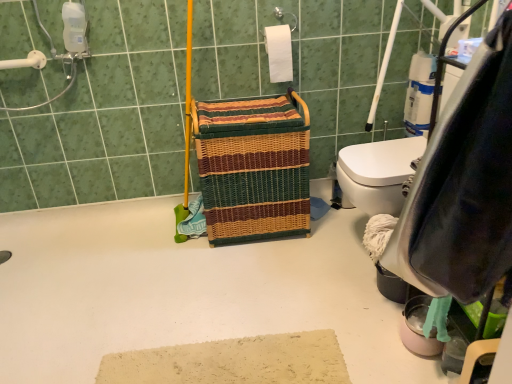
Question: Is white matte toilet paper at upper center oriented towards woven multicolored laundry basket at center?

Choices:
 (A) no
 (B) yes

Answer: (A)

Question: From the image's perspective, is white matte toilet paper at upper center located beneath woven multicolored laundry basket at center?

Choices:
 (A) yes
 (B) no

Answer: (B)

Question: From a real-world perspective, is white matte toilet paper at upper center below woven multicolored laundry basket at center?

Choices:
 (A) no
 (B) yes

Answer: (A)

Question: From a real-world perspective, does white matte toilet paper at upper center stand above woven multicolored laundry basket at center?

Choices:
 (A) no
 (B) yes

Answer: (B)

Question: Does white matte toilet paper at upper center have a lesser height compared to woven multicolored laundry basket at center?

Choices:
 (A) no
 (B) yes

Answer: (B)

Question: Is point (238, 193) positioned closer to the camera than point (273, 41)?

Choices:
 (A) farther
 (B) closer

Answer: (B)

Question: From a real-world perspective, relative to white matte toilet paper at upper center, is woven multicolored laundry basket at center vertically above or below?

Choices:
 (A) below
 (B) above

Answer: (A)

Question: In the image, is woven multicolored laundry basket at center on the left side or the right side of white matte toilet paper at upper center?

Choices:
 (A) left
 (B) right

Answer: (A)

Question: Relative to white matte toilet paper at upper center, is woven multicolored laundry basket at center in front or behind?

Choices:
 (A) front
 (B) behind

Answer: (A)

Question: Considering the relative positions of white plastic grab bar at upper left and woven multicolored laundry basket at center in the image provided, is white plastic grab bar at upper left to the left or to the right of woven multicolored laundry basket at center?

Choices:
 (A) right
 (B) left

Answer: (B)

Question: Is white plastic grab bar at upper left bigger or smaller than woven multicolored laundry basket at center?

Choices:
 (A) small
 (B) big

Answer: (A)

Question: From a real-world perspective, is white plastic grab bar at upper left positioned above or below woven multicolored laundry basket at center?

Choices:
 (A) below
 (B) above

Answer: (B)

Question: Relative to woven multicolored laundry basket at center, is white plastic grab bar at upper left in front or behind?

Choices:
 (A) behind
 (B) front

Answer: (A)

Question: In terms of width, does woven multicolored laundry basket at center look wider or thinner when compared to white plastic grab bar at upper left?

Choices:
 (A) thin
 (B) wide

Answer: (B)

Question: In terms of size, does woven multicolored laundry basket at center appear bigger or smaller than white plastic grab bar at upper left?

Choices:
 (A) small
 (B) big

Answer: (B)